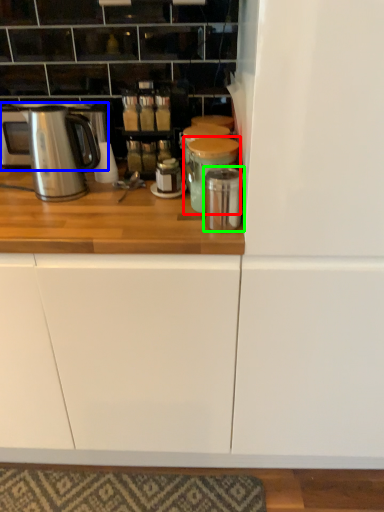
Question: Considering the real-world distances, which object is farthest from appliance (highlighted by a red box)? home appliance (highlighted by a blue box) or appliance (highlighted by a green box)?

Choices:
 (A) home appliance
 (B) appliance

Answer: (A)